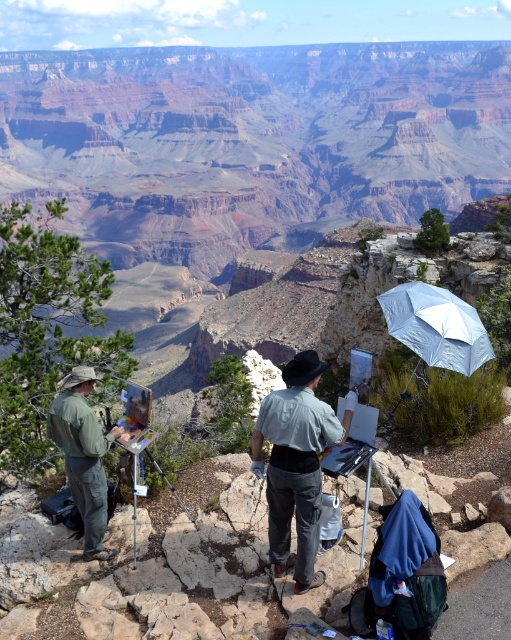
You are a hiker planning to take a photo of the Grand Canyon scene. You want to ensure both the green matte uniform at center and the silver reflective umbrella at upper right are visible in your shot. Based on their positions, which object will appear closer to the bottom of the photo?

The green matte uniform at center appears closer to the bottom of the photo because it is located below the silver reflective umbrella at upper right.

Looking at this image, you are a photographer planning to take a photo of the two artists at the Grand Canyon. The light blue denim shirt at center and the green matte uniform at center are both in the frame. Which artist should you focus on first if you want to capture the taller one?

The light blue denim shirt at center is taller than the green matte uniform at center, so you should focus on the light blue denim shirt at center first.

You are standing at the edge of the Grand Canyon and see a point marked at coordinates (322, 444). If you want to toss a small rock to hit that point, considering your throwing range is 14 meters, will you be able to reach it?

The distance between you and the point (322, 444) is 15.03 meters, which exceeds your throwing range of 14 meters. Therefore, you won not be able to reach it.